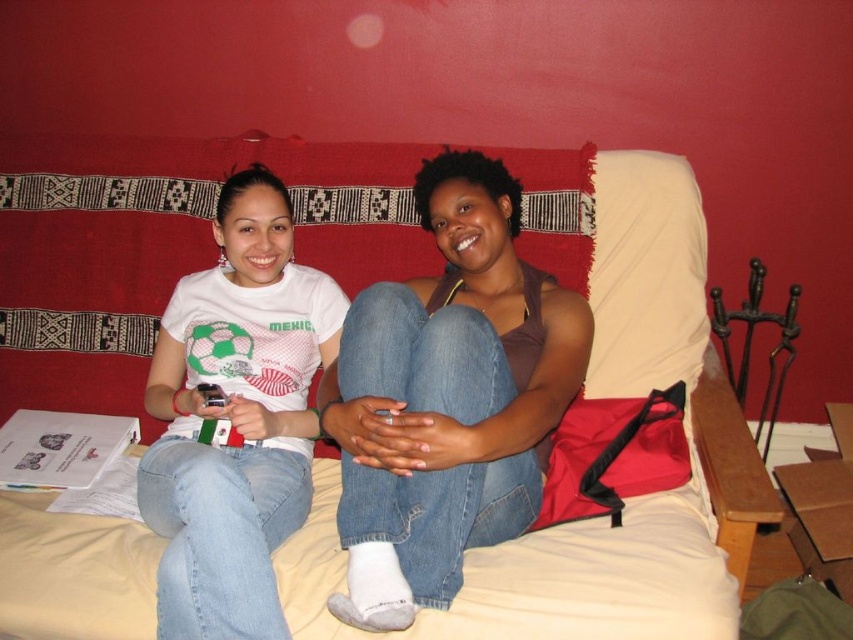
Question: Can you confirm if beige fabric bed at center is positioned below white matte t-shirt at center?

Choices:
 (A) no
 (B) yes

Answer: (A)

Question: Which object is farther from the camera taking this photo?

Choices:
 (A) beige fabric bed at center
 (B) white fabric pillow at upper center
 (C) white matte t-shirt at center

Answer: (B)

Question: Can you confirm if beige fabric bed at center is smaller than white matte t-shirt at center?

Choices:
 (A) no
 (B) yes

Answer: (A)

Question: Does beige fabric bed at center lie behind white fabric pillow at upper center?

Choices:
 (A) yes
 (B) no

Answer: (B)

Question: Which object appears farthest from the camera in this image?

Choices:
 (A) white fabric pillow at upper center
 (B) beige fabric bed at center

Answer: (A)

Question: Based on their relative distances, which object is nearer to the white fabric pillow at upper center?

Choices:
 (A) brown matte tank top at center
 (B) beige fabric bed at center
 (C) white matte t-shirt at center

Answer: (B)